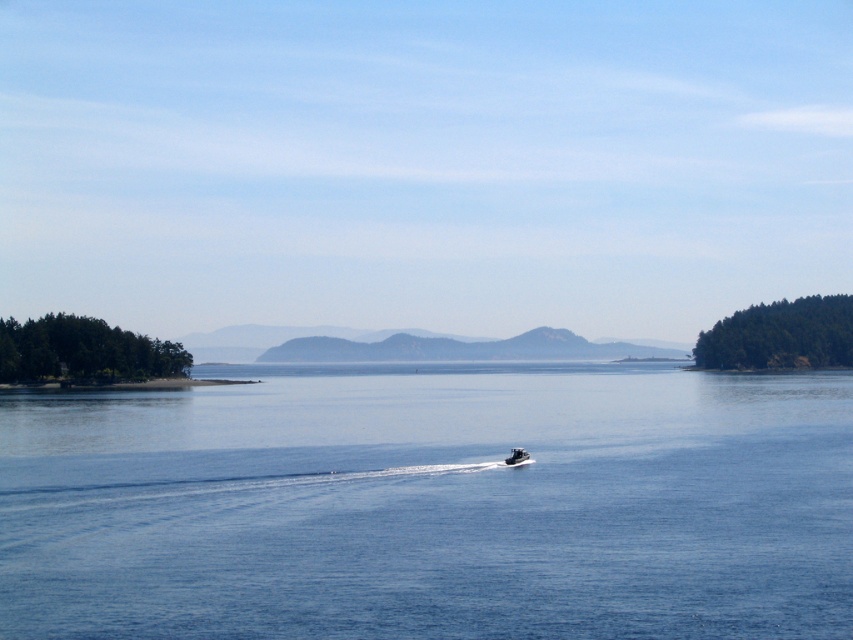
Consider the image. You are a sailor navigating a ship that requires a minimum of 50 meters of open water to safely maneuver. Based on the scene, is there enough space between the blue water at center and the black plastic boat at center to perform this maneuver?

The distance between the blue water at center and the black plastic boat at center is 60.65 meters, which exceeds the required 50 meters. Therefore, there is sufficient space to safely maneuver the ship.

Based on the photo, you are standing on the sandy beach of the closest island on the left side of the frame. You want to reach the densely wooded area on the right side of the frame. There is a point marked at coordinates (432, 506) which is blue water at center. Can you cross the blue water at center to get to the wooded area?

The point marked at coordinates (432, 506) indicates blue water at center, so you cannot cross the blue water at center to reach the densely wooded area on the right side of the frame since it is water.